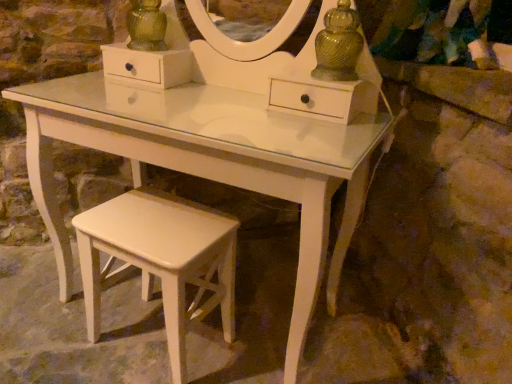
This screenshot has width=512, height=384. What do you see at coordinates (161, 260) in the screenshot? I see `white painted wood stool at lower left` at bounding box center [161, 260].

The height and width of the screenshot is (384, 512). I want to click on white painted wood stool at lower left, so click(x=161, y=260).

Image resolution: width=512 pixels, height=384 pixels. I want to click on white painted wood stool at lower left, so click(161, 260).